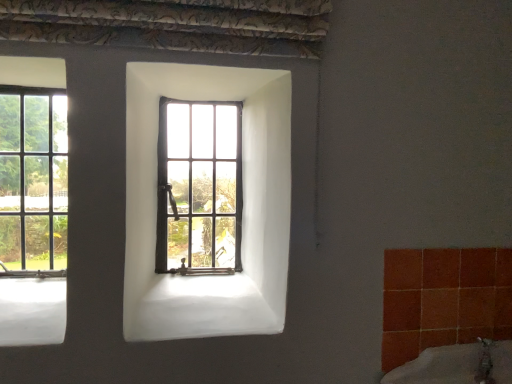
Question: Considering the positions of clear glass window at left, the 1th window in the left-to-right sequence, and wooden-framed window at center, the 2th window when ordered from left to right, in the image, is clear glass window at left, the 1th window in the left-to-right sequence, wider or thinner than wooden-framed window at center, the 2th window when ordered from left to right,?

Choices:
 (A) thin
 (B) wide

Answer: (B)

Question: Considering their positions, is clear glass window at left, placed as the second window when sorted from right to left, located in front of or behind wooden-framed window at center, which is counted as the first window, starting from the right?

Choices:
 (A) front
 (B) behind

Answer: (A)

Question: Estimate the real-world distances between objects in this image. Which object is farther from the clear glass window at left, placed as the second window when sorted from right to left?

Choices:
 (A) wooden-framed window at center, which is counted as the first window, starting from the right
 (B) white ceramic bath at lower right

Answer: (B)

Question: Estimate the real-world distances between objects in this image. Which object is farther from the wooden-framed window at center, the 2th window when ordered from left to right?

Choices:
 (A) clear glass window at left, the 1th window in the left-to-right sequence
 (B) white ceramic bath at lower right

Answer: (B)